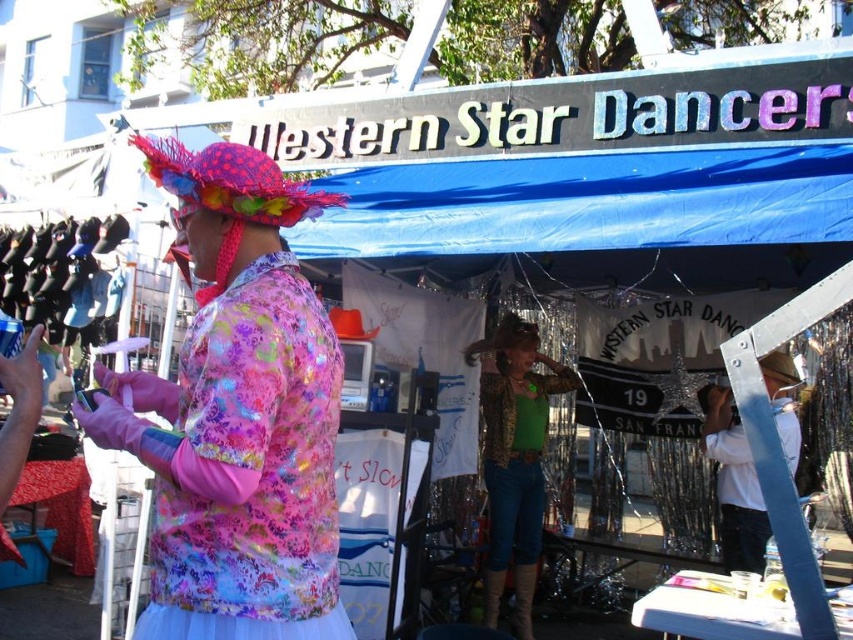
Question: Which of these objects is positioned closest to the floral shiny fabric dress at left?

Choices:
 (A) white cotton shirt at center
 (B) leopard print jacket at center

Answer: (A)

Question: Does floral shiny fabric dress at left lie behind leopard print jacket at center?

Choices:
 (A) no
 (B) yes

Answer: (A)

Question: Considering the relative positions of floral shiny fabric dress at left and leopard print jacket at center in the image provided, where is floral shiny fabric dress at left located with respect to leopard print jacket at center?

Choices:
 (A) left
 (B) right

Answer: (A)

Question: Does leopard print jacket at center lie in front of white cotton shirt at center?

Choices:
 (A) yes
 (B) no

Answer: (B)

Question: Which object is positioned closest to the white cotton shirt at center?

Choices:
 (A) floral shiny fabric dress at left
 (B) leopard print jacket at center

Answer: (B)

Question: Which of the following is the farthest from the observer?

Choices:
 (A) (721, 516)
 (B) (328, 516)
 (C) (546, 426)

Answer: (C)